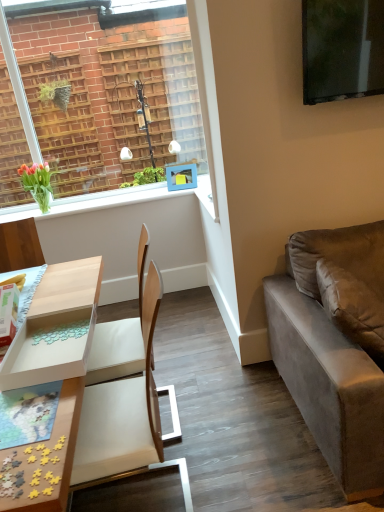
What do you see at coordinates (342, 49) in the screenshot?
I see `matte black television at upper right` at bounding box center [342, 49].

Locate an element on the screen. The height and width of the screenshot is (512, 384). matte black television at upper right is located at coordinates (342, 49).

In order to click on clear glass window at upper left in this screenshot , I will do `click(134, 87)`.

What is the approximate width of suede gray couch at right?

suede gray couch at right is 3.30 feet in width.

What is the approximate width of light blue plastic picture frame at upper center?

5.43 inches.

What do you see at coordinates (131, 197) in the screenshot?
I see `green glass vase at upper left` at bounding box center [131, 197].

The width and height of the screenshot is (384, 512). What do you see at coordinates (54, 372) in the screenshot?
I see `light wood/wooden desk at lower left` at bounding box center [54, 372].

Identify the location of matte black television at upper right. The width and height of the screenshot is (384, 512). (342, 49).

From the picture: Can you confirm if light blue plastic picture frame at upper center is bigger than suede gray couch at right?

Incorrect, light blue plastic picture frame at upper center is not larger than suede gray couch at right.

Does light blue plastic picture frame at upper center touch suede gray couch at right?

light blue plastic picture frame at upper center and suede gray couch at right are not in contact.

Which object is further away from the camera, light blue plastic picture frame at upper center or suede gray couch at right?

light blue plastic picture frame at upper center.

Do you think light blue plastic picture frame at upper center is within suede gray couch at right, or outside of it?

light blue plastic picture frame at upper center is spatially situated outside suede gray couch at right.

From the picture: Does clear glass window at upper left have a lesser height compared to green glass vase at upper left?

No, clear glass window at upper left is not shorter than green glass vase at upper left.

Considering the relative sizes of clear glass window at upper left and green glass vase at upper left in the image provided, is clear glass window at upper left wider than green glass vase at upper left?

No.

How far apart are clear glass window at upper left and green glass vase at upper left?

A distance of 21.62 inches exists between clear glass window at upper left and green glass vase at upper left.

Considering the points (73, 27) and (117, 198), which point is in front, point (73, 27) or point (117, 198)?

Positioned in front is point (73, 27).

Between green glass vase at upper left and matte black television at upper right, which one has less height?

green glass vase at upper left.

Is point (207, 205) positioned behind point (351, 87)?

Yes, it is.

Does green glass vase at upper left appear on the right side of matte black television at upper right?

No, green glass vase at upper left is not to the right of matte black television at upper right.

Are light brown wood chair at center and light wood/wooden desk at lower left far apart?

light brown wood chair at center is actually quite close to light wood/wooden desk at lower left.

Based on their positions, is light brown wood chair at center located to the left or right of light wood/wooden desk at lower left?

Based on their positions, light brown wood chair at center is located to the right of light wood/wooden desk at lower left.

Which object is thinner, light brown wood chair at center or light wood/wooden desk at lower left?

Thinner between the two is light brown wood chair at center.

Consider the image. Who is more distant, light brown wood chair at center or light wood/wooden desk at lower left?

light brown wood chair at center is further away from the camera.

Is suede gray couch at right positioned before matte black television at upper right?

That is True.

Is suede gray couch at right facing towards matte black television at upper right?

No.

The image size is (384, 512). Identify the location of television behind the suede gray couch at right. (342, 49).

From the image's perspective, is suede gray couch at right on top of matte black television at upper right?

No, from the image's perspective, suede gray couch at right is not on top of matte black television at upper right.

Image resolution: width=384 pixels, height=512 pixels. I want to click on picture frame that is under the matte black television at upper right (from a real-world perspective), so click(x=181, y=176).

Is light blue plastic picture frame at upper center far from matte black television at upper right?

Yes, light blue plastic picture frame at upper center and matte black television at upper right are located far from each other.

Consider the image. Which is more to the right, suede gray couch at right or clear glass window at upper left?

suede gray couch at right is more to the right.

What are the coordinates of `studio couch that appears below the clear glass window at upper left (from the image's perspective)` in the screenshot? It's located at pyautogui.click(x=335, y=346).

Does suede gray couch at right contain clear glass window at upper left?

That's incorrect, clear glass window at upper left is not inside suede gray couch at right.

Image resolution: width=384 pixels, height=512 pixels. I want to click on studio couch that appears below the light blue plastic picture frame at upper center (from the image's perspective), so click(x=335, y=346).

Identify the location of window that appears in front of the green glass vase at upper left. (134, 87).

Which object lies nearer to the anchor point matte black television at upper right, light wood/wooden desk at lower left or green glass vase at upper left?

The object closer to matte black television at upper right is green glass vase at upper left.

Looking at the image, which one is located closer to light wood/wooden desk at lower left, matte black television at upper right or clear glass window at upper left?

matte black television at upper right is closer to light wood/wooden desk at lower left.

Looking at the image, which one is located closer to light brown wood chair at center, green glass vase at upper left or clear glass window at upper left?

green glass vase at upper left lies closer to light brown wood chair at center than the other object.

Based on their spatial positions, is matte black television at upper right or green matte vase at upper left further from light brown wood chair at center?

Based on the image, green matte vase at upper left appears to be further to light brown wood chair at center.

Estimate the real-world distances between objects in this image. Which object is further from light blue plastic picture frame at upper center, clear glass window at upper left or green glass vase at upper left?

clear glass window at upper left is positioned further to the anchor light blue plastic picture frame at upper center.

From the image, which object appears to be farther from suede gray couch at right, matte black television at upper right or light wood/wooden desk at lower left?

Based on the image, light wood/wooden desk at lower left appears to be further to suede gray couch at right.

Based on their spatial positions, is light brown wood chair at center or matte black television at upper right closer to clear glass window at upper left?

The object closer to clear glass window at upper left is matte black television at upper right.

Which object lies nearer to the anchor point green matte vase at upper left, clear glass window at upper left or suede gray couch at right?

Based on the image, clear glass window at upper left appears to be nearer to green matte vase at upper left.

Find the location of a particular element. This screenshot has width=384, height=512. television located between light wood/wooden desk at lower left and green matte vase at upper left in the depth direction is located at coordinates (342, 49).

At what (x,y) coordinates should I click in order to perform the action: click on television between light brown wood chair at center and green glass vase at upper left along the z-axis. Please return your answer as a coordinate pair (x, y). Looking at the image, I should click on (342, 49).

The image size is (384, 512). I want to click on houseplant between light wood/wooden desk at lower left and light blue plastic picture frame at upper center along the z-axis, so point(37,183).

I want to click on window sill between light brown wood chair at center and light blue plastic picture frame at upper center in the front-back direction, so click(131, 197).